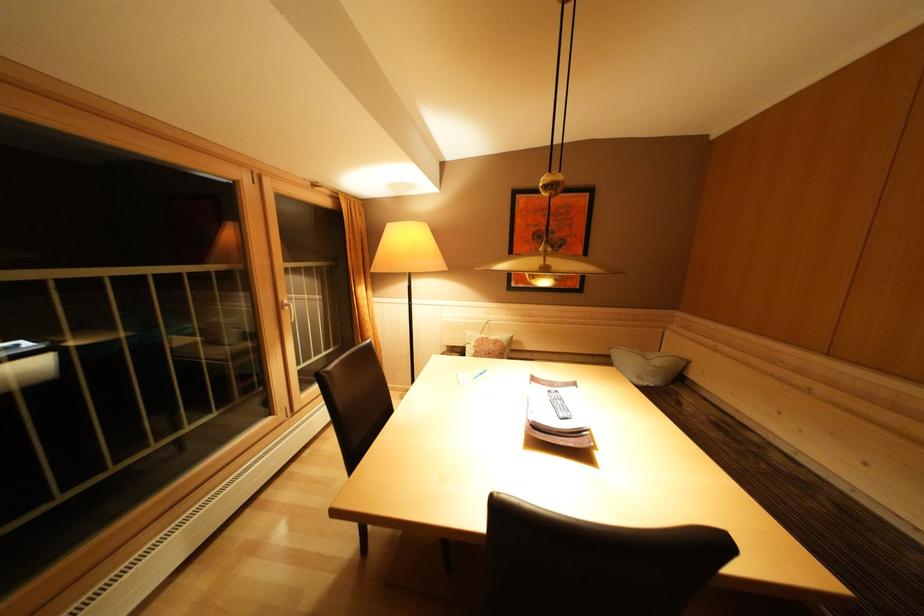
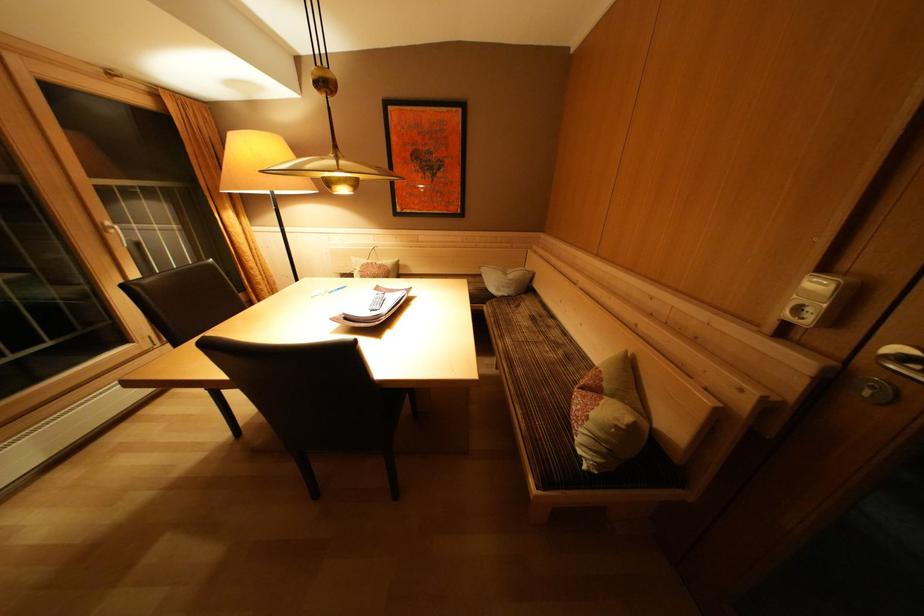
The point at [493,342] is marked in the first image. Where is the corresponding point in the second image?

(379, 268)